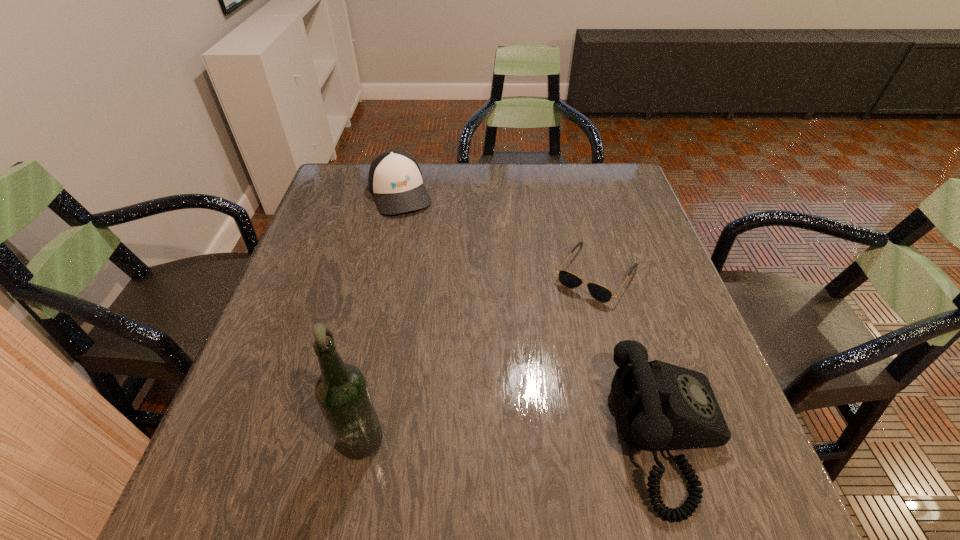
Where is `beer bottle`? This screenshot has height=540, width=960. beer bottle is located at coordinates (341, 391).

The image size is (960, 540). In order to click on telephone in this screenshot , I will do `click(661, 406)`.

The width and height of the screenshot is (960, 540). Identify the location of cap. (395, 180).

Where is `sunglasses`? This screenshot has height=540, width=960. sunglasses is located at coordinates (567, 279).

At what (x,y) coordinates should I click in order to perform the action: click on the shortest object. Please return your answer as a coordinate pair (x, y). Looking at the image, I should click on (567, 279).

Image resolution: width=960 pixels, height=540 pixels. Find the location of `vacant space located on the right of the beer bottle`. vacant space located on the right of the beer bottle is located at coordinates (600, 433).

Identify the location of vacant space positioned on the front panel of the farthest object. The width and height of the screenshot is (960, 540). pos(441,293).

You are a GUI agent. You are given a task and a screenshot of the screen. Output one action in this format:
    pyautogui.click(x=<x>, y=<y>)
    Task: Click on the vacant space situated 0.110m on the front panel of the farthest object
    This screenshot has width=960, height=540.
    Given the screenshot: What is the action you would take?
    pyautogui.click(x=418, y=240)

Locate an element on the screen. The height and width of the screenshot is (540, 960). blank area located 0.140m on the front panel of the farthest object is located at coordinates (420, 247).

Locate an element on the screen. vacant space situated on the front-facing side of the sunglasses is located at coordinates (550, 342).